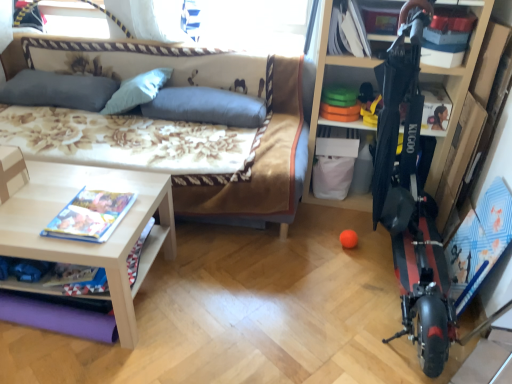
What is the approximate width of floral fabric studio couch at center?

The width of floral fabric studio couch at center is 38.23 inches.

The image size is (512, 384). Describe the element at coordinates (348, 238) in the screenshot. I see `orange matte ball at center` at that location.

Looking at this image, how much space does white paper book at upper right, marked as the first book in a back-to-front arrangement, occupy horizontally?

white paper book at upper right, marked as the first book in a back-to-front arrangement, is 11.09 inches wide.

What do you see at coordinates (320, 96) in the screenshot? I see `wooden shelf at right` at bounding box center [320, 96].

Consider the image. What is the approximate height of light wood/texture table at lower left?

The height of light wood/texture table at lower left is 17.89 inches.

What are the coordinates of `floral fabric studio couch at center` in the screenshot? It's located at (236, 94).

Between floral fabric studio couch at center and hardcover book at lower left, arranged as the 1th book when ordered from the bottom, which one has more height?

With more height is floral fabric studio couch at center.

Is floral fabric studio couch at center far away from hardcover book at lower left, arranged as the 1th book when ordered from the bottom?

No.

From a real-world perspective, is floral fabric studio couch at center located beneath hardcover book at lower left, the first book in the front-to-back sequence?

Correct, in the physical world, floral fabric studio couch at center is lower than hardcover book at lower left, the first book in the front-to-back sequence.

From the image's perspective, is floral fabric studio couch at center positioned above or below hardcover book at lower left, positioned as the second book in right-to-left order?

floral fabric studio couch at center is above hardcover book at lower left, positioned as the second book in right-to-left order.

From the image's perspective, which pillow is the 2nd one above the orange matte ball at center? Please provide its 2D coordinates.

[(137, 91)]

From the picture: Is gray fabric pillow at upper center, which is the 2th pillow from left to right, wider than orange matte ball at center?

Correct, the width of gray fabric pillow at upper center, which is the 2th pillow from left to right, exceeds that of orange matte ball at center.

Can you tell me how much gray fabric pillow at upper center, which is the 2th pillow from left to right, and orange matte ball at center differ in facing direction?

The facing directions of gray fabric pillow at upper center, which is the 2th pillow from left to right, and orange matte ball at center are 2.17 degrees apart.

Is gray fabric pillow at upper center, the second pillow from the right, positioned with its back to orange matte ball at center?

No, orange matte ball at center is not at the back of gray fabric pillow at upper center, the second pillow from the right.

You are a GUI agent. You are given a task and a screenshot of the screen. Output one action in this format:
    pyautogui.click(x=<x>, y=<y>)
    Task: Click on the 1st pillow in front of the gray fabric pillow at upper left, marked as the third pillow in a right-to-left arrangement
    
    Given the screenshot: What is the action you would take?
    pyautogui.click(x=206, y=107)

Can you tell me how much blue fabric pillow at center, the 1th pillow from the right, and gray fabric pillow at upper left, marked as the third pillow in a right-to-left arrangement, differ in facing direction?

The angular difference between blue fabric pillow at center, the 1th pillow from the right, and gray fabric pillow at upper left, marked as the third pillow in a right-to-left arrangement, is 0.927 degrees.

Is blue fabric pillow at center, the 1th pillow from the right, far away from gray fabric pillow at upper left, marked as the third pillow in a right-to-left arrangement?

No, blue fabric pillow at center, the 1th pillow from the right, is in close proximity to gray fabric pillow at upper left, marked as the third pillow in a right-to-left arrangement.

Is blue fabric pillow at center, the 1th pillow from the right, looking in the opposite direction of gray fabric pillow at upper left, marked as the third pillow in a right-to-left arrangement?

No, blue fabric pillow at center, the 1th pillow from the right, is not facing away from gray fabric pillow at upper left, marked as the third pillow in a right-to-left arrangement.

From the image's perspective, would you say floral fabric studio couch at center is shown under light wood/texture table at lower left?

No, from the image's perspective, floral fabric studio couch at center is not beneath light wood/texture table at lower left.

From a real-world perspective, is floral fabric studio couch at center positioned over light wood/texture table at lower left based on gravity?

Correct, in the physical world, floral fabric studio couch at center is higher than light wood/texture table at lower left.

Is floral fabric studio couch at center looking in the opposite direction of light wood/texture table at lower left?

No, floral fabric studio couch at center is not facing the opposite direction of light wood/texture table at lower left.

Does floral fabric studio couch at center have a smaller size compared to light wood/texture table at lower left?

Actually, floral fabric studio couch at center might be larger than light wood/texture table at lower left.

Can you confirm if light wood/texture table at lower left is shorter than hardcover book at lower left, the first book in the front-to-back sequence?

In fact, light wood/texture table at lower left may be taller than hardcover book at lower left, the first book in the front-to-back sequence.

Is light wood/texture table at lower left not close to hardcover book at lower left, the 2th book from the back?

light wood/texture table at lower left is actually quite close to hardcover book at lower left, the 2th book from the back.

At what (x,y) coordinates should I click in order to perform the action: click on the 1st book to the right of the light wood/texture table at lower left, counting from the anchor's position. Please return your answer as a coordinate pair (x, y). The image size is (512, 384). Looking at the image, I should click on (90, 216).

You are a GUI agent. You are given a task and a screenshot of the screen. Output one action in this format:
    pyautogui.click(x=<x>, y=<y>)
    Task: Click on the table below the gray fabric pillow at upper left, marked as the third pillow in a right-to-left arrangement (from the image's perspective)
    
    Given the screenshot: What is the action you would take?
    pyautogui.click(x=91, y=243)

From the picture: Is light wood/texture table at lower left behind gray fabric pillow at upper left, marked as the first pillow in a left-to-right arrangement?

No, it is not.

How distant is light wood/texture table at lower left from gray fabric pillow at upper left, marked as the first pillow in a left-to-right arrangement?

The distance of light wood/texture table at lower left from gray fabric pillow at upper left, marked as the first pillow in a left-to-right arrangement, is 36.69 inches.

In terms of size, does light wood/texture table at lower left appear bigger or smaller than gray fabric pillow at upper left, marked as the first pillow in a left-to-right arrangement?

In the image, light wood/texture table at lower left appears to be larger than gray fabric pillow at upper left, marked as the first pillow in a left-to-right arrangement.

In the image, is light wood/texture table at lower left on the left side or the right side of blue fabric pillow at center, which is counted as the third pillow, starting from the left?

In the image, light wood/texture table at lower left appears on the left side of blue fabric pillow at center, which is counted as the third pillow, starting from the left.

Consider the image. Considering the sizes of light wood/texture table at lower left and blue fabric pillow at center, which is counted as the third pillow, starting from the left, in the image, is light wood/texture table at lower left bigger or smaller than blue fabric pillow at center, which is counted as the third pillow, starting from the left,?

Clearly, light wood/texture table at lower left is larger in size than blue fabric pillow at center, which is counted as the third pillow, starting from the left.

Between light wood/texture table at lower left and blue fabric pillow at center, the 1th pillow from the right, which one has larger width?

With larger width is light wood/texture table at lower left.

I want to click on studio couch above the hardcover book at lower left, the second book viewed from the top (from the image's perspective), so click(x=236, y=94).

Locate an element on the screen. toy on the right side of gray fabric pillow at upper center, the second pillow from the right is located at coordinates (348, 238).

Looking at the image, which one is located closer to gray fabric pillow at upper left, marked as the first pillow in a left-to-right arrangement, wooden shelf at right or light wood/texture table at lower left?

light wood/texture table at lower left is closer to gray fabric pillow at upper left, marked as the first pillow in a left-to-right arrangement.

Looking at the image, which one is located further to orange matte ball at center, wooden shelf at right or light wood/texture table at lower left?

Among the two, light wood/texture table at lower left is located further to orange matte ball at center.

Considering their positions, is light wood/texture table at lower left positioned further to hardcover book at lower left, arranged as the 1th book when ordered from the bottom, than wooden shelf at right?

wooden shelf at right is positioned further to the anchor hardcover book at lower left, arranged as the 1th book when ordered from the bottom.

From the image, which object appears to be farther from floral fabric studio couch at center, gray fabric pillow at upper left, marked as the third pillow in a right-to-left arrangement, or hardcover book at lower left, the 1th book in the left-to-right sequence?

Among the two, hardcover book at lower left, the 1th book in the left-to-right sequence, is located further to floral fabric studio couch at center.

From the image, which object appears to be farther from gray fabric pillow at upper center, which is the 2th pillow from left to right, orange matte ball at center or light wood/texture table at lower left?

orange matte ball at center.

Based on their spatial positions, is blue fabric pillow at center, which is counted as the third pillow, starting from the left, or orange matte ball at center closer to hardcover book at lower left, the 1th book in the left-to-right sequence?

blue fabric pillow at center, which is counted as the third pillow, starting from the left, lies closer to hardcover book at lower left, the 1th book in the left-to-right sequence, than the other object.

Considering their positions, is floral fabric studio couch at center positioned closer to orange matte ball at center than light wood/texture table at lower left?

Based on the image, floral fabric studio couch at center appears to be nearer to orange matte ball at center.

Looking at the image, which one is located closer to blue fabric pillow at center, which is counted as the third pillow, starting from the left, wooden shelf at right or orange matte ball at center?

wooden shelf at right is positioned closer to the anchor blue fabric pillow at center, which is counted as the third pillow, starting from the left.

Identify the location of studio couch located between light wood/texture table at lower left and white paper book at upper right, placed as the 2th book when sorted from bottom to top, in the left-right direction. This screenshot has width=512, height=384. [236, 94].

Where is `toy located between gray fabric pillow at upper center, the second pillow from the right, and wooden shelf at right in the left-right direction`? Image resolution: width=512 pixels, height=384 pixels. toy located between gray fabric pillow at upper center, the second pillow from the right, and wooden shelf at right in the left-right direction is located at coordinates (348, 238).

At what (x,y) coordinates should I click in order to perform the action: click on studio couch situated between gray fabric pillow at upper left, marked as the first pillow in a left-to-right arrangement, and wooden shelf at right from left to right. Please return your answer as a coordinate pair (x, y). This screenshot has width=512, height=384. Looking at the image, I should click on point(236,94).

I want to click on book between gray fabric pillow at upper left, marked as the third pillow in a right-to-left arrangement, and white paper book at upper right, arranged as the 1th book when viewed from the right, so click(90, 216).